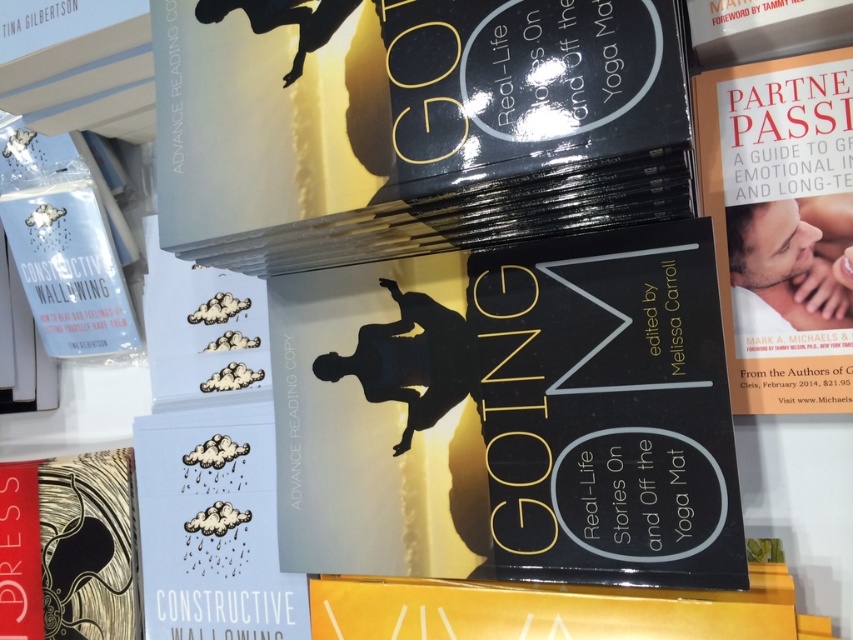
Question: Does matte black book at center have a smaller size compared to orange paper book at right?

Choices:
 (A) no
 (B) yes

Answer: (A)

Question: Does matte black book at center appear over orange paper book at right?

Choices:
 (A) no
 (B) yes

Answer: (A)

Question: Which point is farther from the camera taking this photo?

Choices:
 (A) (694, 392)
 (B) (816, 358)

Answer: (B)

Question: Is matte black book at center to the right of orange paper book at right from the viewer's perspective?

Choices:
 (A) yes
 (B) no

Answer: (B)

Question: Which point is farther to the camera?

Choices:
 (A) orange paper book at right
 (B) matte black book at center

Answer: (A)